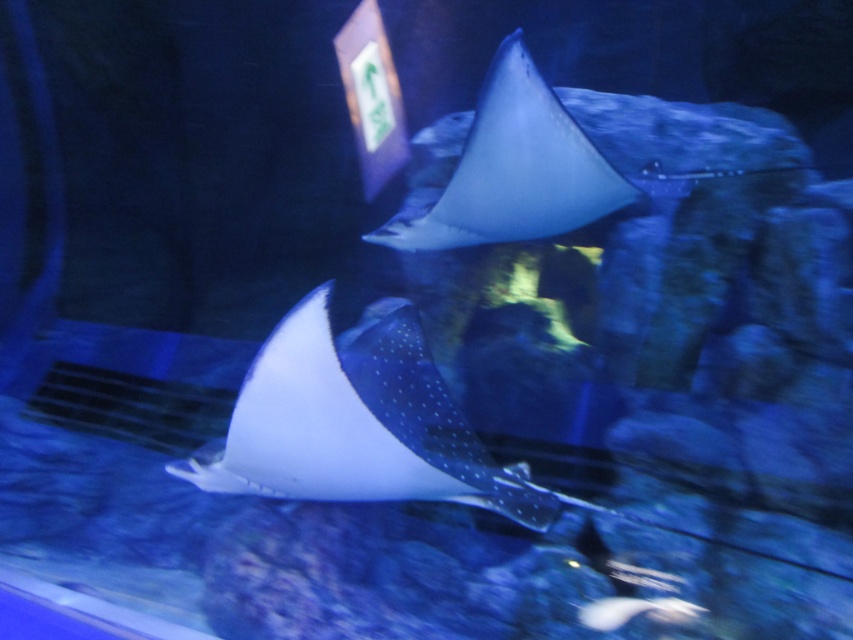
Question: Is the position of white dotted stingray at center less distant than that of white dotted stingray at upper center?

Choices:
 (A) no
 (B) yes

Answer: (B)

Question: Which point is closer to the camera?

Choices:
 (A) (553, 93)
 (B) (258, 410)

Answer: (B)

Question: Is white dotted stingray at center in front of white dotted stingray at upper center?

Choices:
 (A) no
 (B) yes

Answer: (B)

Question: Among these objects, which one is nearest to the camera?

Choices:
 (A) white dotted stingray at center
 (B) white dotted stingray at upper center

Answer: (A)

Question: Can you confirm if white dotted stingray at center is positioned above white dotted stingray at upper center?

Choices:
 (A) no
 (B) yes

Answer: (A)